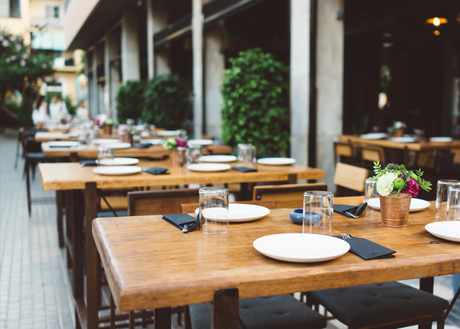
Image resolution: width=460 pixels, height=329 pixels. I want to click on glasses on tables, so click(x=208, y=220), click(x=322, y=220), click(x=453, y=196), click(x=444, y=196), click(x=372, y=199), click(x=246, y=149), click(x=103, y=152).